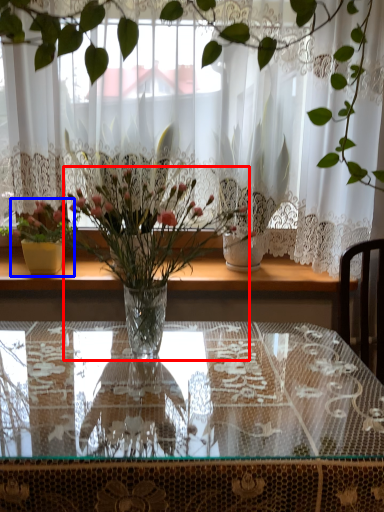
Question: Which object appears farthest to the camera in this image, houseplant (highlighted by a red box) or houseplant (highlighted by a blue box)?

Choices:
 (A) houseplant
 (B) houseplant

Answer: (B)